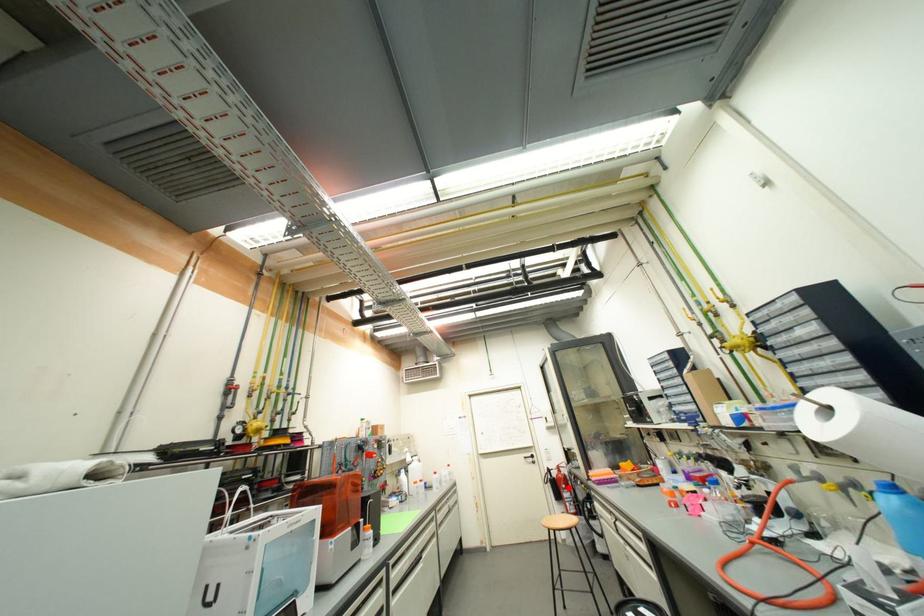
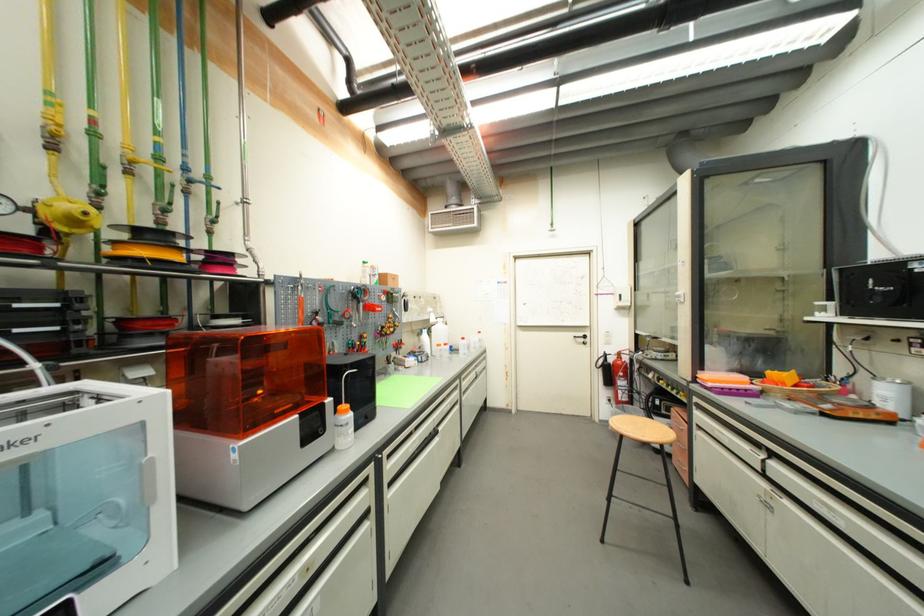
Question: I am providing you with two images of the same scene from different viewpoints. Given a red point in image1, look at the same physical point in image2. Is it:

Choices:
 (A) Closer to the viewpoint
 (B) Farther from the viewpoint

Answer: (A)